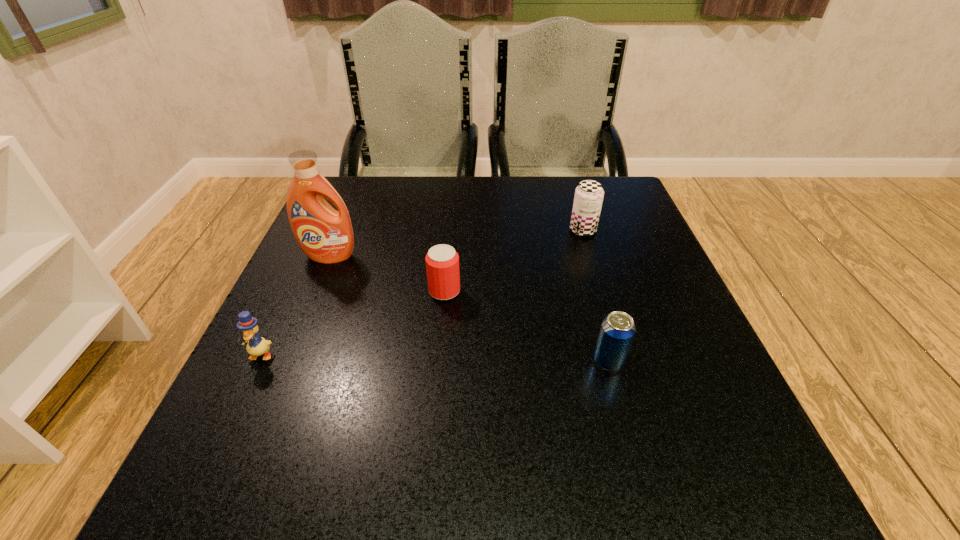
The image size is (960, 540). I want to click on free space located on the back of the nearest beer can, so click(594, 307).

At what (x,y) coordinates should I click in order to perform the action: click on vacant area situated 0.320m on the front of the leftmost beer can. Please return your answer as a coordinate pair (x, y). Looking at the image, I should click on pyautogui.click(x=428, y=469).

Where is `vacant space located on the face of the duckling, where the monocle is placed`? The image size is (960, 540). vacant space located on the face of the duckling, where the monocle is placed is located at coordinates (230, 418).

Image resolution: width=960 pixels, height=540 pixels. I want to click on object that is positioned at the far edge, so click(589, 194).

At what (x,y) coordinates should I click in order to perform the action: click on detergent located in the left edge section of the desktop. Please return your answer as a coordinate pair (x, y). Image resolution: width=960 pixels, height=540 pixels. Looking at the image, I should click on (325, 235).

You are a GUI agent. You are given a task and a screenshot of the screen. Output one action in this format:
    pyautogui.click(x=<x>, y=<y>)
    Task: Click on the duckling that is at the left edge
    This screenshot has width=960, height=540.
    Given the screenshot: What is the action you would take?
    pyautogui.click(x=256, y=346)

At what (x,y) coordinates should I click in order to perform the action: click on object situated at the far right corner. Please return your answer as a coordinate pair (x, y). The height and width of the screenshot is (540, 960). Looking at the image, I should click on (589, 194).

In the image, there is a desktop. Where is `vacant space at the far edge`? This screenshot has width=960, height=540. vacant space at the far edge is located at coordinates click(x=486, y=194).

Locate an element on the screen. Image resolution: width=960 pixels, height=540 pixels. free space at the near edge is located at coordinates (409, 507).

You are a GUI agent. You are given a task and a screenshot of the screen. Output one action in this format:
    pyautogui.click(x=<x>, y=<y>)
    Task: Click on the vacant space at the left edge of the desktop
    
    Given the screenshot: What is the action you would take?
    pyautogui.click(x=370, y=238)